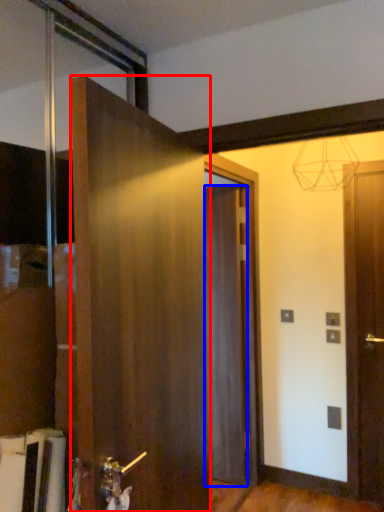
Question: Among these objects, which one is farthest to the camera, door (highlighted by a red box) or door (highlighted by a blue box)?

Choices:
 (A) door
 (B) door

Answer: (B)